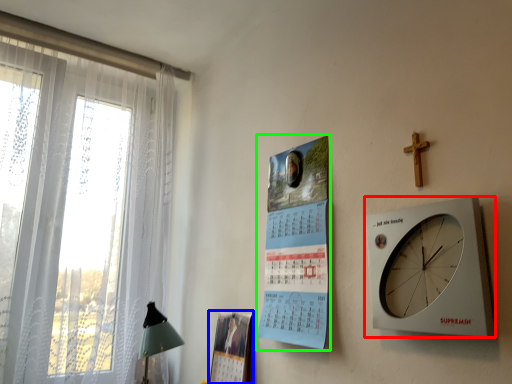
Question: Based on their relative distances, which object is farther from wall clock (highlighted by a red box)? Choose from magazine (highlighted by a blue box) and poster page (highlighted by a green box).

Choices:
 (A) magazine
 (B) poster page

Answer: (A)